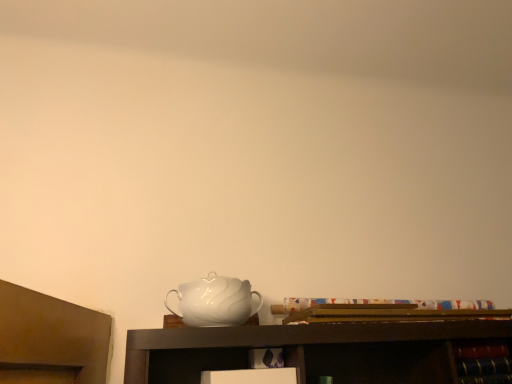
Question: From their relative heights in the image, would you say white glossy jug at center is taller or shorter than wooden cabinet at lower right?

Choices:
 (A) tall
 (B) short

Answer: (A)

Question: Does point (245, 301) appear closer or farther from the camera than point (480, 370)?

Choices:
 (A) farther
 (B) closer

Answer: (B)

Question: Relative to wooden cabinet at lower right, is white glossy jug at center in front or behind?

Choices:
 (A) front
 (B) behind

Answer: (A)

Question: Would you say wooden cabinet at lower right is to the left or to the right of white glossy jug at center in the picture?

Choices:
 (A) left
 (B) right

Answer: (B)

Question: Looking at the image, does wooden cabinet at lower right seem bigger or smaller compared to white glossy jug at center?

Choices:
 (A) big
 (B) small

Answer: (B)

Question: From a real-world perspective, is wooden cabinet at lower right physically located above or below white glossy jug at center?

Choices:
 (A) above
 (B) below

Answer: (B)

Question: Relative to white glossy jug at center, is wooden cabinet at lower right in front or behind?

Choices:
 (A) front
 (B) behind

Answer: (B)